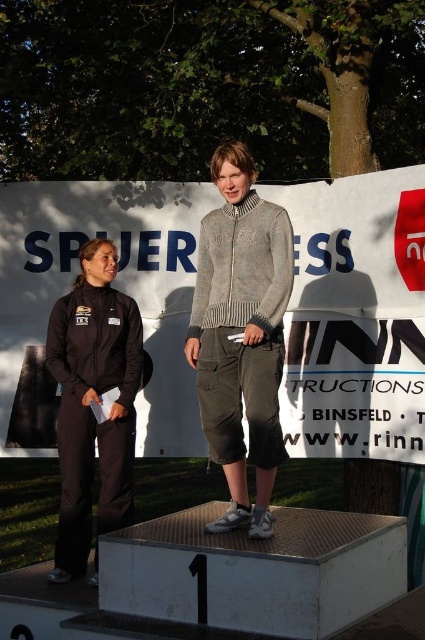
You are a photographer at the event and need to capture a closeup shot of both the knitted sweater at center and the black matte tracksuit at left. Given their sizes, which one requires you to stand further back to fit entirely into the frame?

The black matte tracksuit at left is wider than the knitted sweater at center, so you need to stand further back to fit the black matte tracksuit at left into the frame.

You are a photographer at the event and need to capture a photo that includes both the knitted sweater at center and the black matte tracksuit at left. What is the minimum distance you need to move backward to ensure both are in frame?

The knitted sweater at center and the black matte tracksuit at left are 38.37 inches apart. To include both in the photo, you need to move back at least 38.37 inches to ensure the camera can capture the full distance between them.

You are a photographer at the event and need to capture a clear photo of the knitted sweater at center and the black matte tracksuit at left. Which clothing item is covering part of the other?

The knitted sweater at center is positioned over the black matte tracksuit at left, so it is covering part of it.